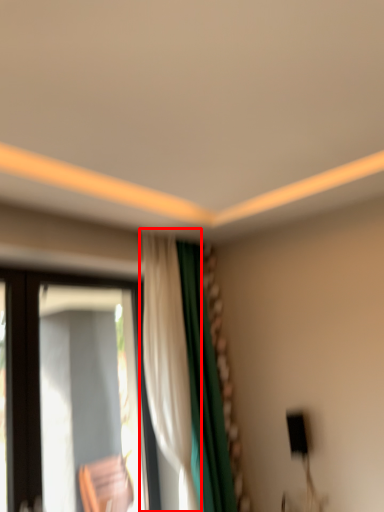
Question: In this image, where is curtain (annotated by the red box) located relative to window?

Choices:
 (A) right
 (B) left

Answer: (A)